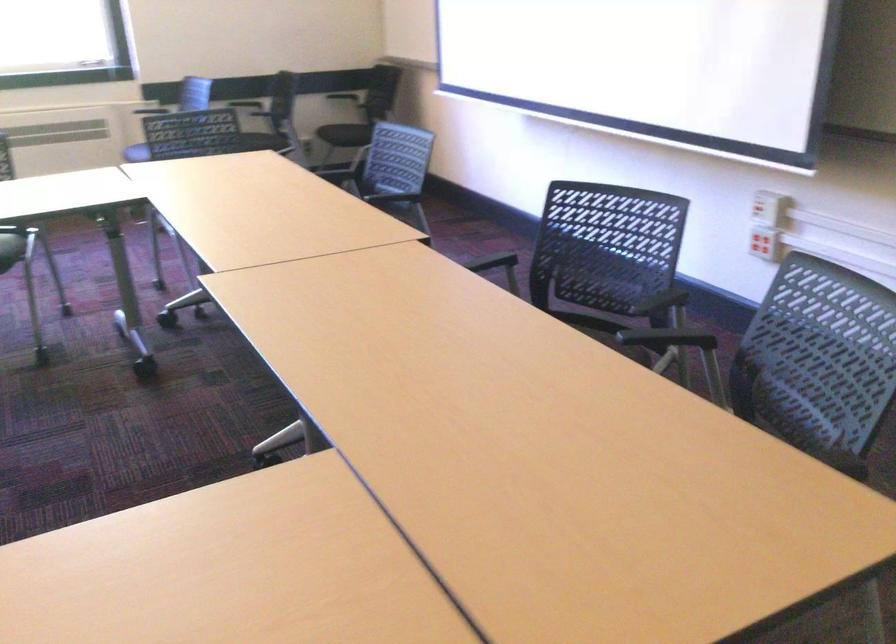
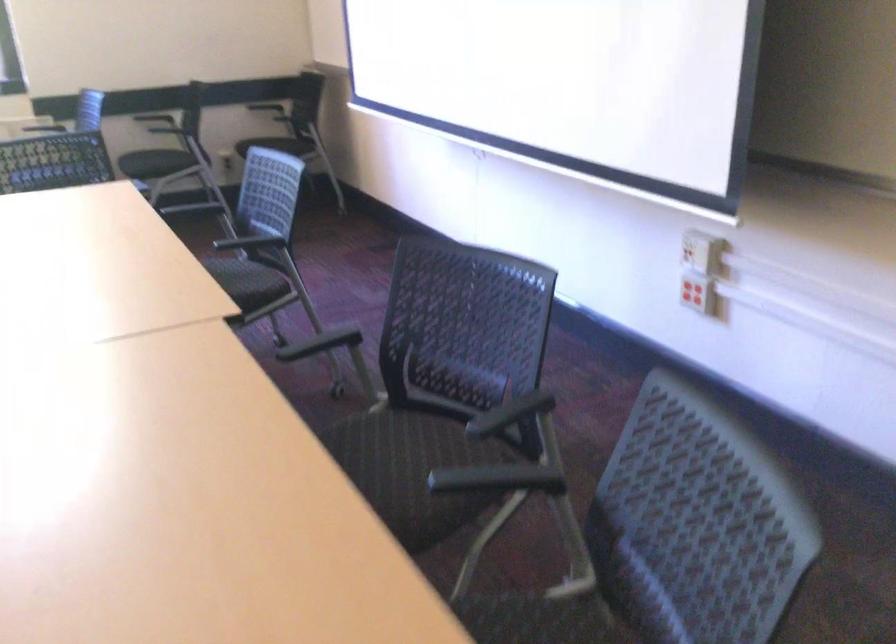
Question: The camera is either moving clockwise (left) or counter-clockwise (right) around the object. The first image is from the beginning of the video and the second image is from the end. Is the camera moving left or right when shooting the video?

Choices:
 (A) Left
 (B) Right

Answer: (A)